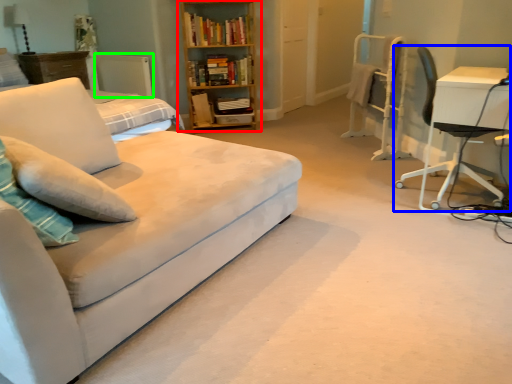
Question: Which object is positioned closest to bookcase (highlighted by a red box)? Select from chair (highlighted by a blue box) and radiator (highlighted by a green box).

Choices:
 (A) chair
 (B) radiator

Answer: (B)